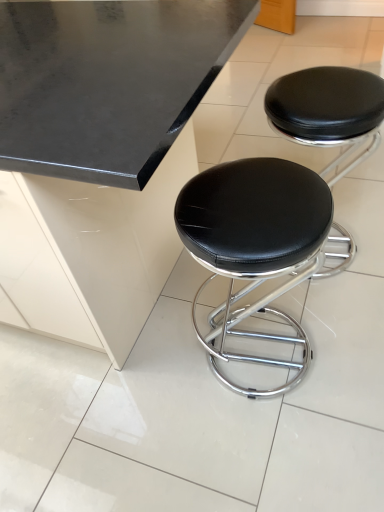
Locate an element on the screen. vacant point above black leather stool at center, which ranks as the 1th stool in right-to-left order (from a real-world perspective) is located at coordinates (338, 87).